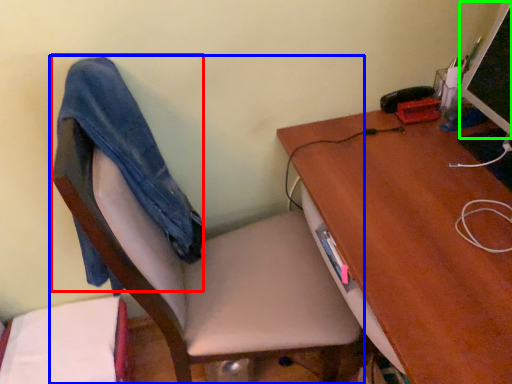
Question: Estimate the real-world distances between objects in this image. Which object is farther from jeans (highlighted by a red box), chair (highlighted by a blue box) or computer monitor (highlighted by a green box)?

Choices:
 (A) chair
 (B) computer monitor

Answer: (B)